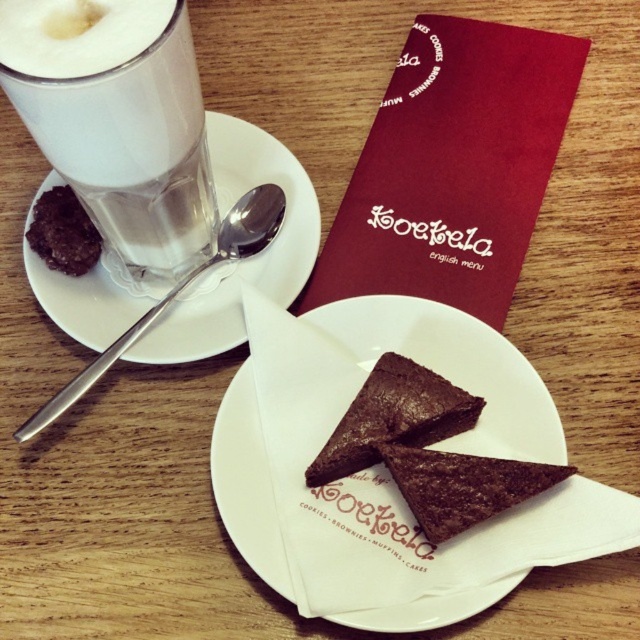
Between white ceramic saucer at upper left and chocolate matte at left, which one has more height?

Standing taller between the two is white ceramic saucer at upper left.

The image size is (640, 640). Find the location of `white ceramic saucer at upper left`. white ceramic saucer at upper left is located at coordinates (244, 259).

Which is behind, point (304, 280) or point (92, 259)?

The point (92, 259) is more distant.

The height and width of the screenshot is (640, 640). In order to click on white ceramic saucer at upper left in this screenshot , I will do `click(244, 259)`.

Is white ceramic saucer at upper left above chocolate matte at center?

Correct, white ceramic saucer at upper left is located above chocolate matte at center.

Can you confirm if white ceramic saucer at upper left is taller than chocolate matte at center?

Correct, white ceramic saucer at upper left is much taller as chocolate matte at center.

Who is more forward, (54,296) or (449,433)?

Point (449,433)

Locate an element on the screen. white ceramic saucer at upper left is located at coordinates (244, 259).

Is foamy white latte at left bigger than chocolate cake at center?

Indeed, foamy white latte at left has a larger size compared to chocolate cake at center.

Does foamy white latte at left have a greater height compared to chocolate cake at center?

Yes.

Is point (138, 196) closer to camera compared to point (465, 484)?

No, (138, 196) is further to viewer.

I want to click on foamy white latte at left, so click(x=132, y=154).